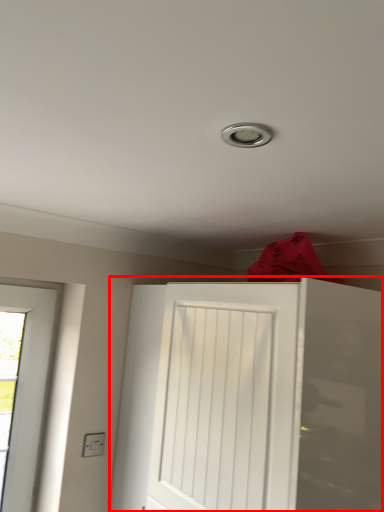
Question: From the image's perspective, where is door (annotated by the red box) located relative to electric outlet?

Choices:
 (A) below
 (B) above

Answer: (B)